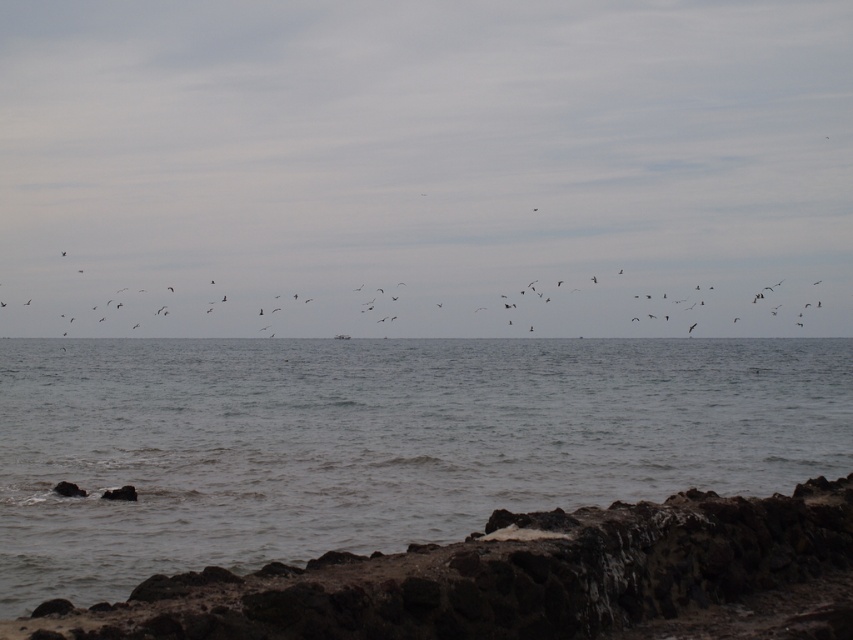
Question: Based on their relative distances, which object is nearer to the gray matte water at center?

Choices:
 (A) dark gray feathers at upper center
 (B) rough volcanic rock at lower right

Answer: (B)

Question: Which point appears closest to the camera in this image?

Choices:
 (A) (846, 285)
 (B) (456, 406)
 (C) (424, 634)

Answer: (C)

Question: Can you confirm if rough volcanic rock at lower right is thinner than dark gray feathers at upper center?

Choices:
 (A) no
 (B) yes

Answer: (B)

Question: Does gray matte water at center appear over dark gray feathers at upper center?

Choices:
 (A) yes
 (B) no

Answer: (B)

Question: Can you confirm if rough volcanic rock at lower right is positioned above dark gray feathers at upper center?

Choices:
 (A) yes
 (B) no

Answer: (B)

Question: Which point appears closest to the camera in this image?

Choices:
 (A) (590, 458)
 (B) (216, 316)
 (C) (602, 604)

Answer: (C)